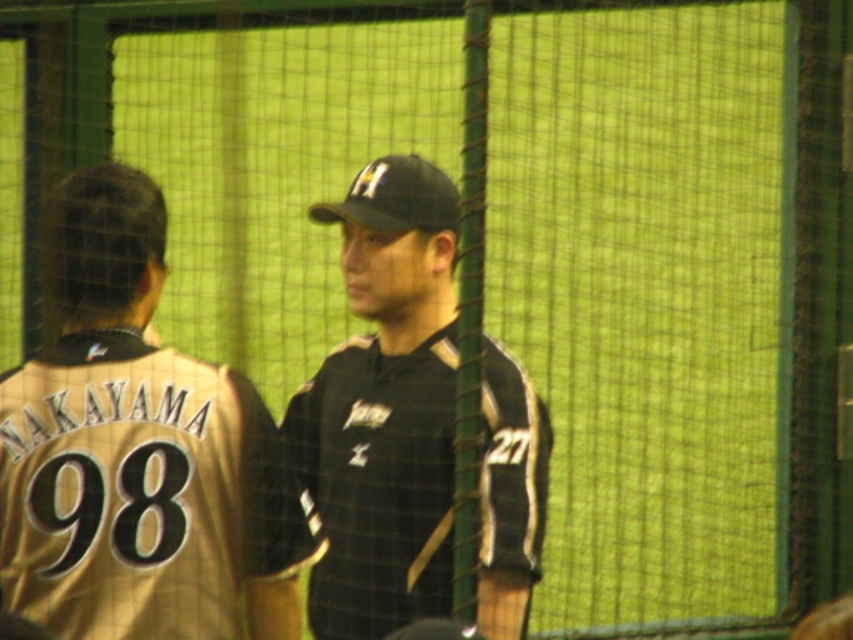
Can you confirm if black matte uniform at center is taller than black matte baseball cap at center?

Yes.

Can you confirm if black matte uniform at center is positioned above black matte baseball cap at center?

Actually, black matte uniform at center is below black matte baseball cap at center.

What do you see at coordinates (383, 410) in the screenshot? Image resolution: width=853 pixels, height=640 pixels. I see `black matte uniform at center` at bounding box center [383, 410].

Where is `black matte uniform at center`? This screenshot has height=640, width=853. black matte uniform at center is located at coordinates (383, 410).

Between point (190, 515) and point (421, 419), which one is positioned behind?

The point (421, 419) is behind.

Can you confirm if gold jersey at left is positioned above black matte uniform at center?

Yes, gold jersey at left is above black matte uniform at center.

Find the location of a particular element. This screenshot has width=853, height=640. gold jersey at left is located at coordinates (135, 451).

Does gold jersey at left lie in front of black matte baseball cap at center?

Yes, it is.

Is gold jersey at left bigger than black matte baseball cap at center?

Yes.

Who is more forward, (x=294, y=627) or (x=325, y=220)?

Point (x=294, y=627) is more forward.

Where is `gold jersey at left`? This screenshot has height=640, width=853. gold jersey at left is located at coordinates (135, 451).